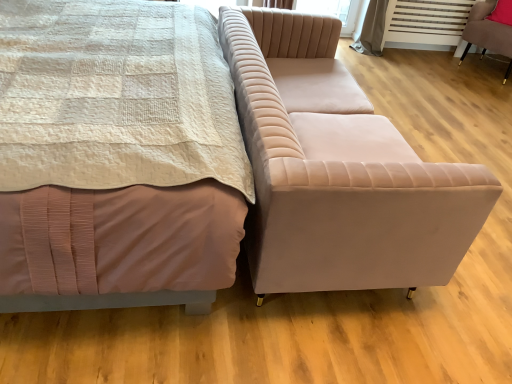
Find the location of a particular element. vacant area in front of velvet pink chair at right is located at coordinates (480, 91).